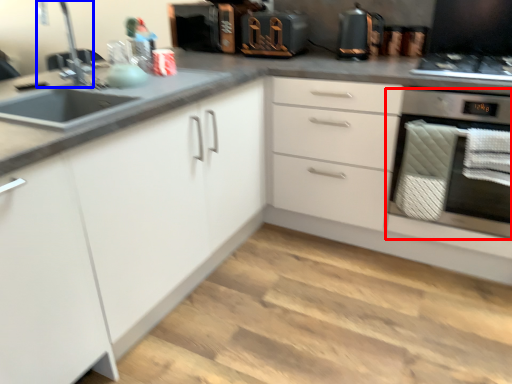
Question: Which point is further to the camera, home appliance (highlighted by a red box) or faucet (highlighted by a blue box)?

Choices:
 (A) home appliance
 (B) faucet

Answer: (A)